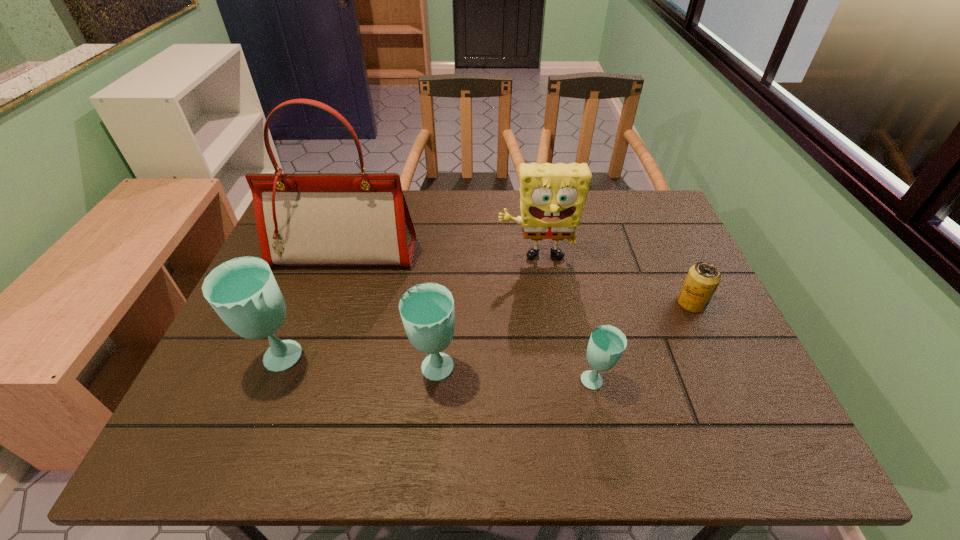
At what (x,y) coordinates should I click in order to perform the action: click on vacant space situated on the back of the fourth tallest object. Please return your answer as a coordinate pair (x, y). Image resolution: width=960 pixels, height=540 pixels. Looking at the image, I should click on (440, 309).

Locate an element on the screen. free space located 0.150m on the back of the shortest glass is located at coordinates (582, 317).

You are a GUI agent. You are given a task and a screenshot of the screen. Output one action in this format:
    pyautogui.click(x=<x>, y=<y>)
    Task: Click on the vacant region located on the face of the sponge
    The height and width of the screenshot is (540, 960).
    Given the screenshot: What is the action you would take?
    pyautogui.click(x=556, y=399)

You are a GUI agent. You are given a task and a screenshot of the screen. Output one action in this format:
    pyautogui.click(x=<x>, y=<y>)
    Task: Click on the free spot located 0.330m on the left of the rightmost object
    The height and width of the screenshot is (540, 960).
    Given the screenshot: What is the action you would take?
    pyautogui.click(x=548, y=303)

What are the coordinates of `vacant area situated on the right of the tallest object` in the screenshot? It's located at (516, 254).

Identify the location of glass that is at the left edge. (243, 291).

Where is `handbag at the left edge`? The height and width of the screenshot is (540, 960). handbag at the left edge is located at coordinates (328, 219).

Locate an element on the screen. object positioned at the right edge is located at coordinates (703, 278).

This screenshot has width=960, height=540. Find the location of `object present at the near left corner`. object present at the near left corner is located at coordinates (243, 291).

Where is `vacant space at the far edge of the desktop`? This screenshot has height=540, width=960. vacant space at the far edge of the desktop is located at coordinates (615, 225).